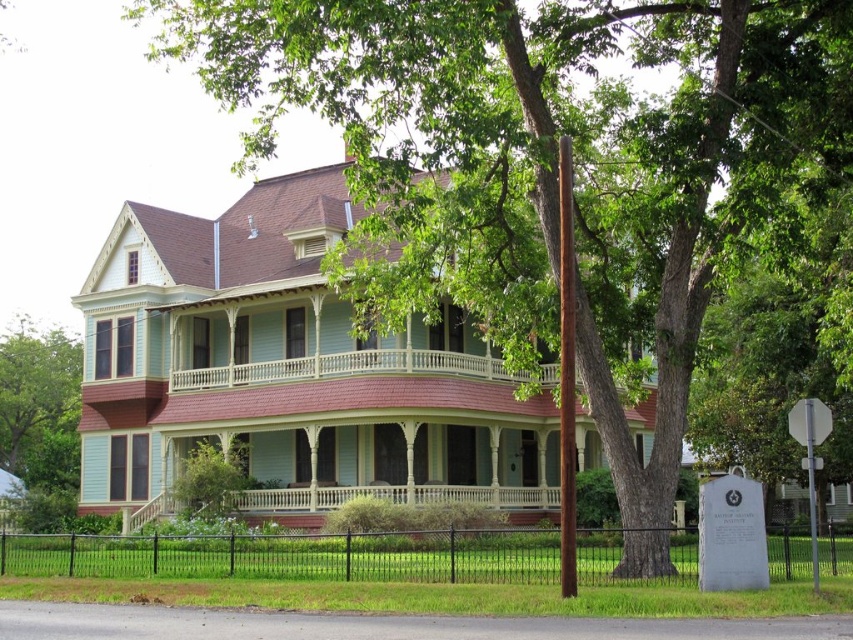
Question: Which point appears closest to the camera in this image?

Choices:
 (A) (538, 561)
 (B) (71, 368)

Answer: (A)

Question: Does black metal fence at lower center have a greater width compared to green leafy tree at left?

Choices:
 (A) no
 (B) yes

Answer: (B)

Question: Is black metal fence at lower center thinner than green leafy tree at left?

Choices:
 (A) no
 (B) yes

Answer: (A)

Question: Which point is closer to the camera?

Choices:
 (A) (45, 392)
 (B) (349, 554)

Answer: (B)

Question: Is black metal fence at lower center positioned in front of green leafy tree at left?

Choices:
 (A) yes
 (B) no

Answer: (A)